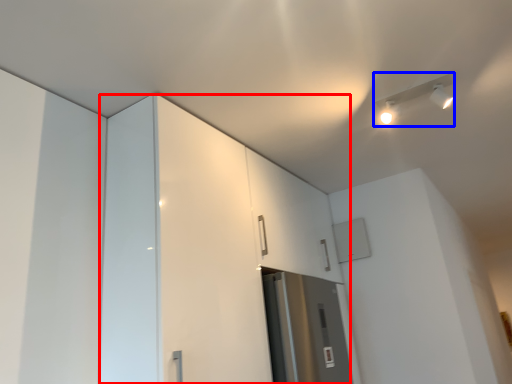
Question: Among these objects, which one is nearest to the camera, dresser (highlighted by a red box) or light fixture (highlighted by a blue box)?

Choices:
 (A) dresser
 (B) light fixture

Answer: (A)